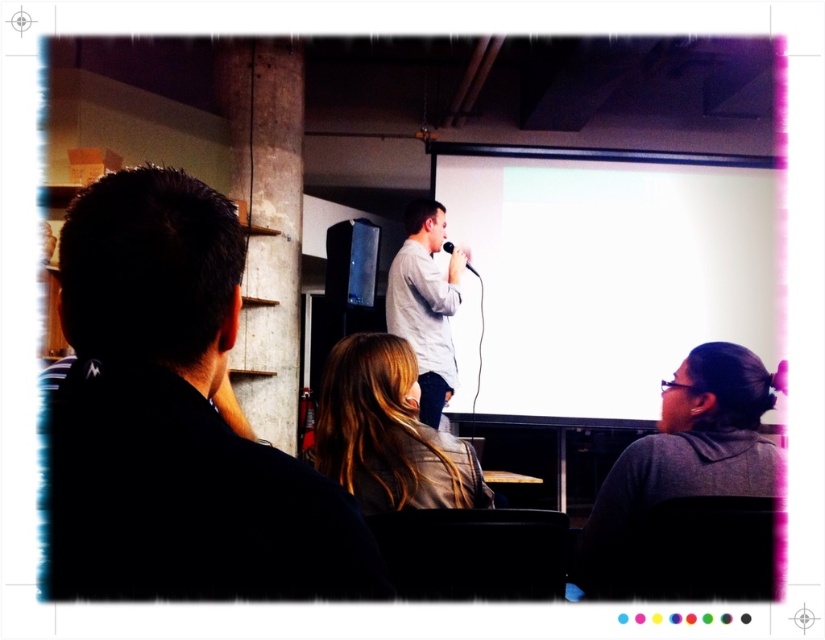
The width and height of the screenshot is (825, 640). Describe the element at coordinates (175, 420) in the screenshot. I see `black matte jacket at left` at that location.

Is point (177, 564) less distant than point (573, 218)?

Yes, it is in front of point (573, 218).

Is point (215, 529) closer to camera compared to point (633, 352)?

Yes, it is in front of point (633, 352).

The height and width of the screenshot is (640, 825). Find the location of `black matte jacket at left`. black matte jacket at left is located at coordinates (175, 420).

How much distance is there between gray matte jacket at lower right and blonde hair at center?

gray matte jacket at lower right and blonde hair at center are 43.65 centimeters apart from each other.

Does gray matte jacket at lower right appear on the right side of blonde hair at center?

Yes, gray matte jacket at lower right is to the right of blonde hair at center.

Measure the distance between point (x=686, y=408) and camera.

They are 1.83 meters apart.

Where is `gray matte jacket at lower right`? Image resolution: width=825 pixels, height=640 pixels. gray matte jacket at lower right is located at coordinates (684, 458).

Is point (214, 524) behind point (640, 508)?

No.

In the scene shown: Measure the distance between black matte jacket at left and camera.

black matte jacket at left and camera are 26.90 inches apart from each other.

Where is `black matte jacket at left`? This screenshot has height=640, width=825. black matte jacket at left is located at coordinates (175, 420).